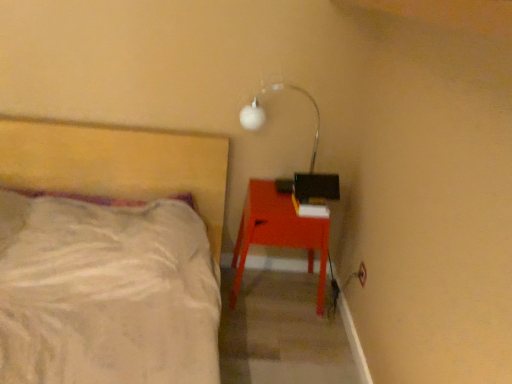
Question: Does white glossy lamp at upper right touch matte red desk at right?

Choices:
 (A) no
 (B) yes

Answer: (A)

Question: Is white glossy lamp at upper right to the left of matte red desk at right from the viewer's perspective?

Choices:
 (A) yes
 (B) no

Answer: (B)

Question: From the image's perspective, is white glossy lamp at upper right located above matte red desk at right?

Choices:
 (A) yes
 (B) no

Answer: (A)

Question: Considering the relative sizes of white glossy lamp at upper right and matte red desk at right in the image provided, is white glossy lamp at upper right shorter than matte red desk at right?

Choices:
 (A) yes
 (B) no

Answer: (A)

Question: Is white glossy lamp at upper right looking in the opposite direction of matte red desk at right?

Choices:
 (A) no
 (B) yes

Answer: (A)

Question: Is white glossy lamp at upper right positioned behind matte red desk at right?

Choices:
 (A) yes
 (B) no

Answer: (B)

Question: Is matte red desk at right to the left of white glossy lamp at upper right from the viewer's perspective?

Choices:
 (A) no
 (B) yes

Answer: (B)

Question: Can you confirm if matte red desk at right is wider than white glossy lamp at upper right?

Choices:
 (A) yes
 (B) no

Answer: (A)

Question: Does matte red desk at right appear on the right side of white glossy lamp at upper right?

Choices:
 (A) no
 (B) yes

Answer: (A)

Question: Does matte red desk at right have a greater height compared to white glossy lamp at upper right?

Choices:
 (A) no
 (B) yes

Answer: (B)

Question: Is the position of matte red desk at right less distant than that of white glossy lamp at upper right?

Choices:
 (A) yes
 (B) no

Answer: (B)

Question: Is matte red desk at right shorter than white glossy lamp at upper right?

Choices:
 (A) no
 (B) yes

Answer: (A)

Question: Is point (247, 248) closer or farther from the camera than point (310, 167)?

Choices:
 (A) closer
 (B) farther

Answer: (A)